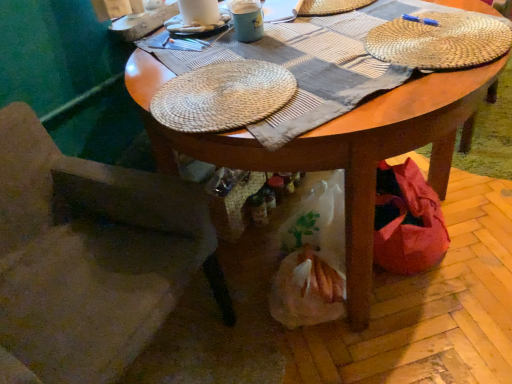
Question: Considering the relative sizes of woven straw placemat at center, which is the 3th hat in top-to-bottom order, and woven straw placemat at upper right, which appears as the 2th hat when ordered from the bottom, in the image provided, is woven straw placemat at center, which is the 3th hat in top-to-bottom order, bigger than woven straw placemat at upper right, which appears as the 2th hat when ordered from the bottom,?

Choices:
 (A) no
 (B) yes

Answer: (B)

Question: Considering the relative positions of woven straw placemat at center, which is the 3th hat in top-to-bottom order, and woven straw placemat at upper right, which appears as the 2th hat when ordered from the bottom, in the image provided, is woven straw placemat at center, which is the 3th hat in top-to-bottom order, to the right of woven straw placemat at upper right, which appears as the 2th hat when ordered from the bottom, from the viewer's perspective?

Choices:
 (A) no
 (B) yes

Answer: (A)

Question: Does woven straw placemat at center, which is the 3th hat in top-to-bottom order, have a smaller size compared to woven straw placemat at upper right, which appears as the 2th hat when ordered from the bottom?

Choices:
 (A) yes
 (B) no

Answer: (B)

Question: Is woven straw placemat at center, which is the 3th hat in top-to-bottom order, taller than woven straw placemat at upper right, which appears as the 2th hat when viewed from the top?

Choices:
 (A) no
 (B) yes

Answer: (B)

Question: Considering the relative sizes of woven straw placemat at center, which is the 3th hat in top-to-bottom order, and woven straw placemat at upper right, which appears as the 2th hat when viewed from the top, in the image provided, is woven straw placemat at center, which is the 3th hat in top-to-bottom order, thinner than woven straw placemat at upper right, which appears as the 2th hat when viewed from the top,?

Choices:
 (A) yes
 (B) no

Answer: (B)

Question: From a real-world perspective, is woven straw placemat at center, which is the 3th hat in top-to-bottom order, positioned under woven straw placemat at upper right, which appears as the 2th hat when ordered from the bottom, based on gravity?

Choices:
 (A) yes
 (B) no

Answer: (B)

Question: From a real-world perspective, is woven straw placemat at center, which is the 3th hat in top-to-bottom order, positioned over white woven hat at upper center, the 1th hat from the top, based on gravity?

Choices:
 (A) no
 (B) yes

Answer: (B)

Question: Is woven straw placemat at center, which is the first hat in bottom-to-top order, next to white woven hat at upper center, the 1th hat from the top?

Choices:
 (A) no
 (B) yes

Answer: (A)

Question: Can you confirm if woven straw placemat at center, which is the 3th hat in top-to-bottom order, is shorter than white woven hat at upper center, the third hat from the bottom?

Choices:
 (A) yes
 (B) no

Answer: (B)

Question: Would you say white woven hat at upper center, the 1th hat from the top, is part of woven straw placemat at center, which is the first hat in bottom-to-top order,'s contents?

Choices:
 (A) yes
 (B) no

Answer: (B)

Question: Is woven straw placemat at center, which is the first hat in bottom-to-top order, at the left side of white woven hat at upper center, the third hat from the bottom?

Choices:
 (A) no
 (B) yes

Answer: (B)

Question: From the image's perspective, is woven straw placemat at center, which is the first hat in bottom-to-top order, under white woven hat at upper center, the third hat from the bottom?

Choices:
 (A) no
 (B) yes

Answer: (B)

Question: From the image's perspective, does woven straw placemat at upper right, which appears as the 2th hat when ordered from the bottom, appear higher than white woven hat at upper center, the third hat from the bottom?

Choices:
 (A) no
 (B) yes

Answer: (A)